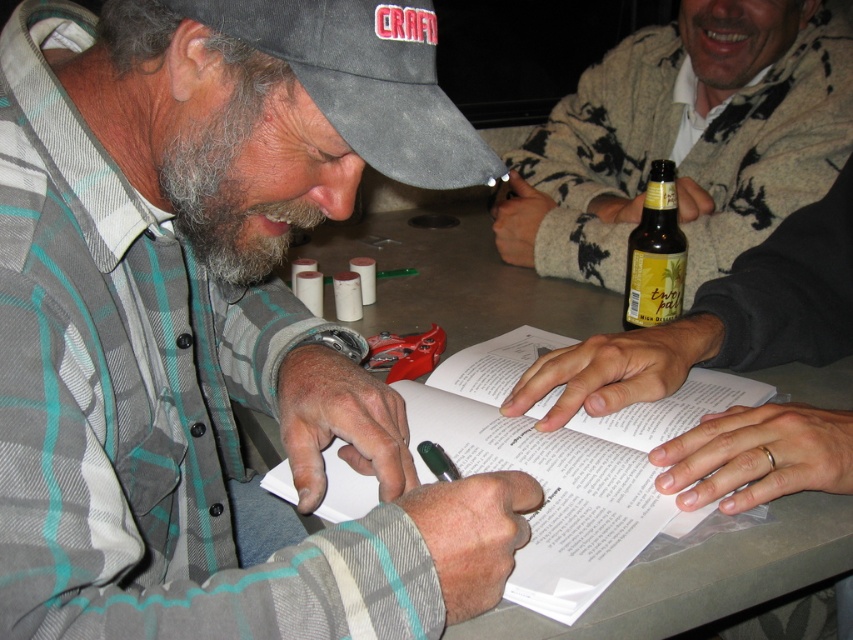
Question: Is plaid flannel shirt at center to the right of graywoollybeard at left from the viewer's perspective?

Choices:
 (A) no
 (B) yes

Answer: (B)

Question: Is graywoollybeard at left below green matte pen at lower center?

Choices:
 (A) no
 (B) yes

Answer: (A)

Question: Does matte brown paper at center appear over gray matte table at center?

Choices:
 (A) no
 (B) yes

Answer: (B)

Question: Which point is farther to the camera?

Choices:
 (A) (705, 500)
 (B) (428, 467)
 (C) (3, 92)
 (D) (206, 188)

Answer: (B)

Question: Which object is the farthest from the black fabric baseball cap at upper left?

Choices:
 (A) green matte pen at lower center
 (B) plaid flannel shirt at center

Answer: (A)

Question: Which object is positioned closest to the gray matte table at center?

Choices:
 (A) graywoollybeard at left
 (B) beige sweater at upper right
 (C) green matte pen at lower center

Answer: (C)